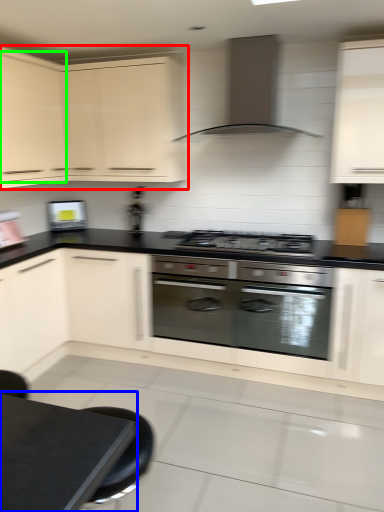
Question: Which object is positioned farthest from cabinetry (highlighted by a red box)? Select from table (highlighted by a blue box) and cabinetry (highlighted by a green box).

Choices:
 (A) table
 (B) cabinetry

Answer: (A)